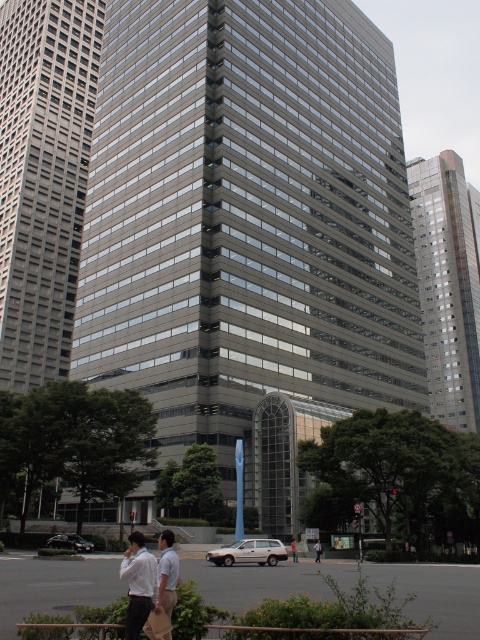
Question: Which point is closer to the camera?

Choices:
 (A) (90, 131)
 (B) (294, 538)

Answer: (B)

Question: Can you confirm if gray concrete building at center is positioned to the left of white shirt at center?

Choices:
 (A) yes
 (B) no

Answer: (A)

Question: Is metallic glass skyscraper at center wider than white shirt at lower center?

Choices:
 (A) no
 (B) yes

Answer: (B)

Question: Can you confirm if gray concrete building at center is positioned below metallic glass skyscraper at center?

Choices:
 (A) no
 (B) yes

Answer: (A)

Question: Among these points, which one is farthest from the camera?

Choices:
 (A) (476, 432)
 (B) (0, 106)
 (C) (294, 552)

Answer: (A)

Question: Which object is the farthest from the gray concrete building at center?

Choices:
 (A) white shirt at lower center
 (B) metallic glass skyscraper at center
 (C) white shirt at center
 (D) gray glass building at center

Answer: (C)